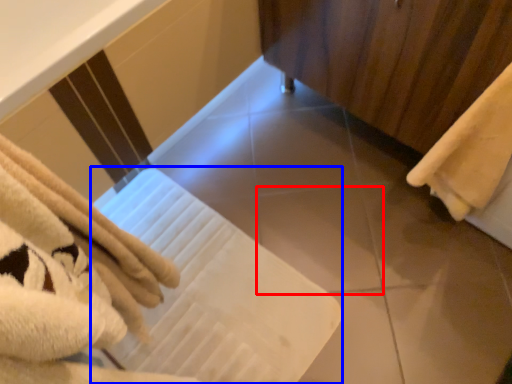
Question: Among these objects, which one is farthest to the camera, tile (highlighted by a red box) or bath towel (highlighted by a blue box)?

Choices:
 (A) tile
 (B) bath towel

Answer: (A)